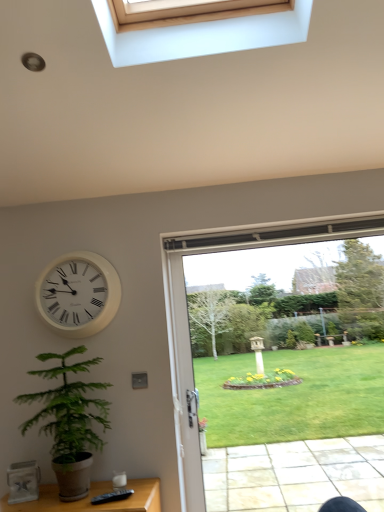
Question: Should I look upward or downward to see white plastic clock at upper left?

Choices:
 (A) down
 (B) up

Answer: (A)

Question: Is clear glass door at center taller than white plastic clock at upper left?

Choices:
 (A) no
 (B) yes

Answer: (B)

Question: Does clear glass door at center come behind white plastic clock at upper left?

Choices:
 (A) yes
 (B) no

Answer: (B)

Question: From a real-world perspective, is clear glass door at center on top of white plastic clock at upper left?

Choices:
 (A) no
 (B) yes

Answer: (A)

Question: Is white plastic clock at upper left inside clear glass door at center?

Choices:
 (A) yes
 (B) no

Answer: (B)

Question: Can you confirm if clear glass door at center is smaller than white plastic clock at upper left?

Choices:
 (A) no
 (B) yes

Answer: (A)

Question: Does clear glass door at center have a lesser width compared to white plastic clock at upper left?

Choices:
 (A) yes
 (B) no

Answer: (A)

Question: Is white plastic clock at upper left shorter than green leafy plant at lower left?

Choices:
 (A) no
 (B) yes

Answer: (B)

Question: From a real-world perspective, is white plastic clock at upper left positioned over green leafy plant at lower left based on gravity?

Choices:
 (A) no
 (B) yes

Answer: (B)

Question: Is white plastic clock at upper left at the left side of green leafy plant at lower left?

Choices:
 (A) no
 (B) yes

Answer: (B)

Question: Could you tell me if white plastic clock at upper left is facing green leafy plant at lower left?

Choices:
 (A) no
 (B) yes

Answer: (A)

Question: Is white plastic clock at upper left taller than green leafy plant at lower left?

Choices:
 (A) yes
 (B) no

Answer: (B)

Question: From the image's perspective, does white plastic clock at upper left appear lower than green leafy plant at lower left?

Choices:
 (A) no
 (B) yes

Answer: (A)

Question: Considering the relative sizes of green leafy plant at lower left and white plastic clock at upper left in the image provided, is green leafy plant at lower left shorter than white plastic clock at upper left?

Choices:
 (A) yes
 (B) no

Answer: (B)